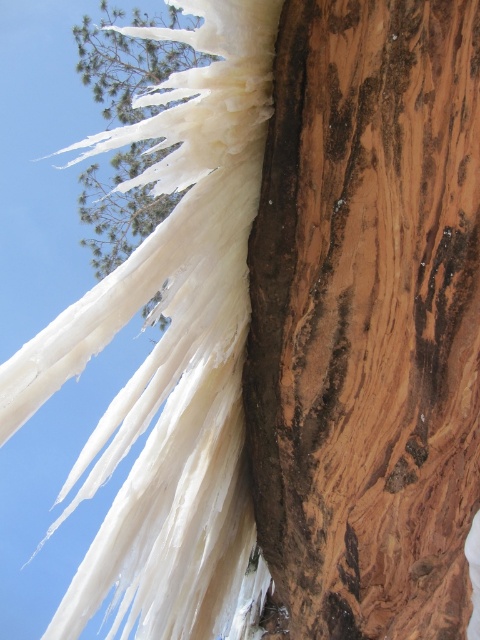
Question: Does brown wood at center have a larger size compared to white frosty tree at upper left?

Choices:
 (A) no
 (B) yes

Answer: (B)

Question: Among these points, which one is farthest from the camera?

Choices:
 (A) (96, 170)
 (B) (407, 406)

Answer: (A)

Question: Does brown wood at center appear on the left side of white frosty tree at upper left?

Choices:
 (A) no
 (B) yes

Answer: (A)

Question: Which point appears closest to the camera in this image?

Choices:
 (A) (158, 150)
 (B) (267, 147)

Answer: (B)

Question: Does brown wood at center have a larger size compared to white frosty tree at upper left?

Choices:
 (A) yes
 (B) no

Answer: (A)

Question: Which point appears closest to the camera in this image?

Choices:
 (A) (137, 90)
 (B) (385, 595)

Answer: (B)